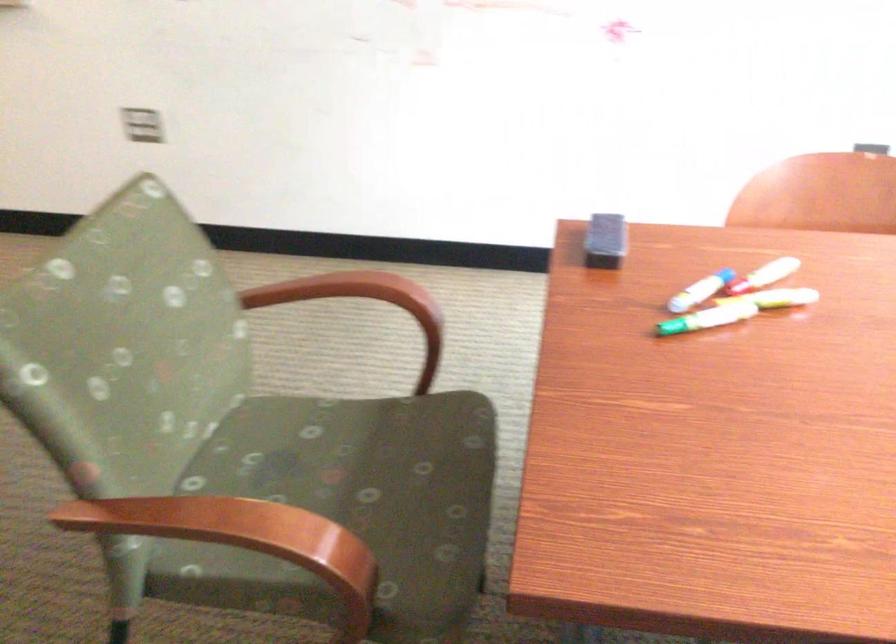
Image resolution: width=896 pixels, height=644 pixels. Describe the element at coordinates (362, 453) in the screenshot. I see `the chair sitting surface` at that location.